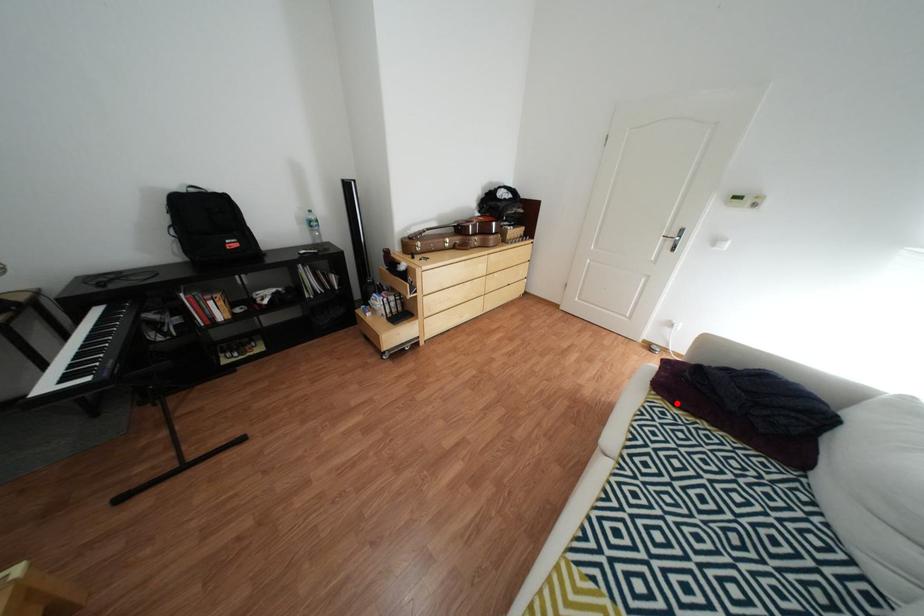
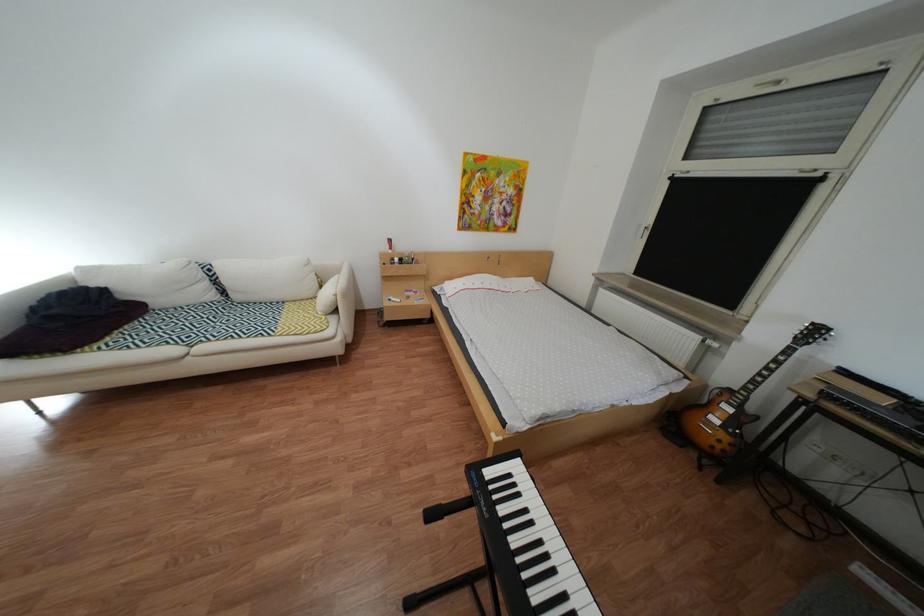
Find the pixel in the second image that matches the highlighted location in the first image.

(113, 346)